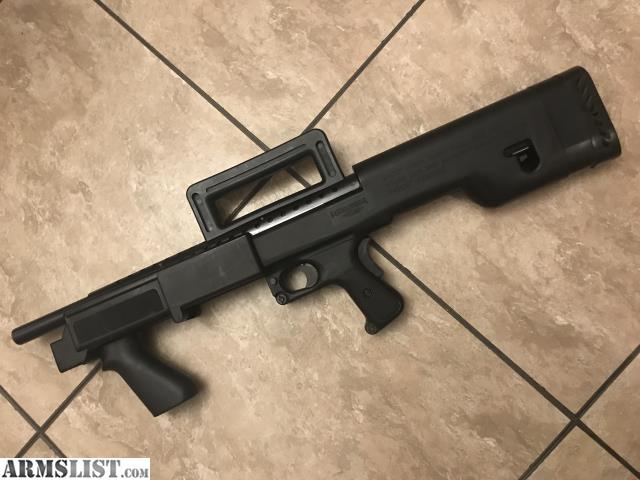
Locate an element on the screen. The height and width of the screenshot is (480, 640). marbled effect on flooring is located at coordinates (477, 413), (518, 315), (572, 267), (608, 240), (491, 264), (239, 86), (16, 99), (27, 149), (38, 214), (404, 436).